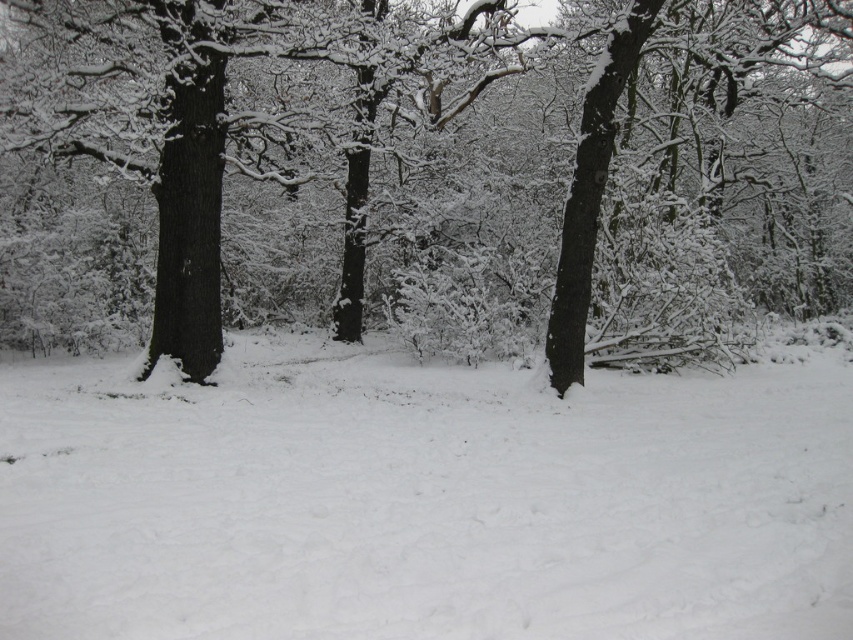
Is point (619, 148) closer to camera compared to point (720, 467)?

No, (619, 148) is further to viewer.

Locate an element on the screen. smooth bark tree at center is located at coordinates (425, 168).